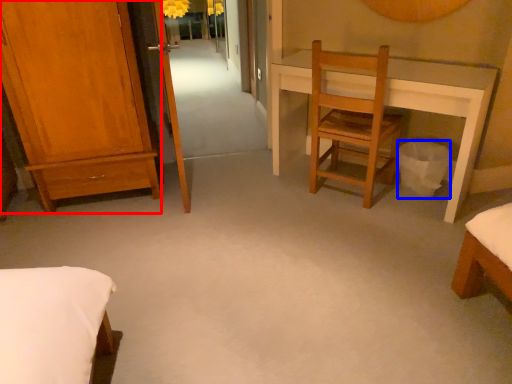
Question: Which object appears closest to the camera in this image, furniture (highlighted by a red box) or trash bin/can (highlighted by a blue box)?

Choices:
 (A) furniture
 (B) trash bin/can

Answer: (A)